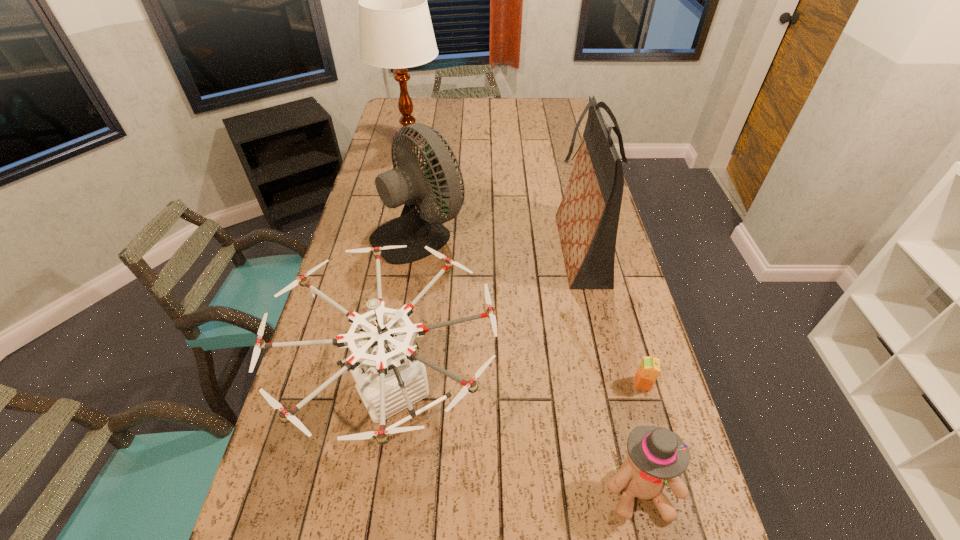
Identify the location of vacant space at the left edge of the desktop. (321, 372).

In the image, there is a desktop. Identify the location of blank space at the right edge. The height and width of the screenshot is (540, 960). (591, 304).

The image size is (960, 540). I want to click on free space between the shopping bag and the orange juice, so click(x=611, y=316).

You are a GUI agent. You are given a task and a screenshot of the screen. Output one action in this format:
    pyautogui.click(x=<x>, y=<y>)
    Task: Click on the empty location between the shopping bag and the fan
    This screenshot has height=540, width=960.
    Given the screenshot: What is the action you would take?
    pyautogui.click(x=499, y=241)

What are the coordinates of `blank region between the fan and the shopping bag` in the screenshot? It's located at (499, 241).

Find the location of a particular element. The height and width of the screenshot is (540, 960). vacant region between the shortest object and the shopping bag is located at coordinates (611, 316).

At what (x,y) coordinates should I click in order to perform the action: click on free spot between the shortest object and the table lamp. Please return your answer as a coordinate pair (x, y). The image size is (960, 540). Looking at the image, I should click on (526, 262).

Locate an element on the screen. The width and height of the screenshot is (960, 540). vacant area between the drone and the orange juice is located at coordinates (519, 388).

Locate an element on the screen. This screenshot has height=540, width=960. unoccupied area between the table lamp and the shopping bag is located at coordinates (494, 195).

Point out which object is positioned as the third nearest to the shortest object. Please provide its 2D coordinates. Your answer should be formatted as a tuple, i.e. [(x, y)], where the tuple contains the x and y coordinates of a point satisfying the conditions above.

[(390, 376)]